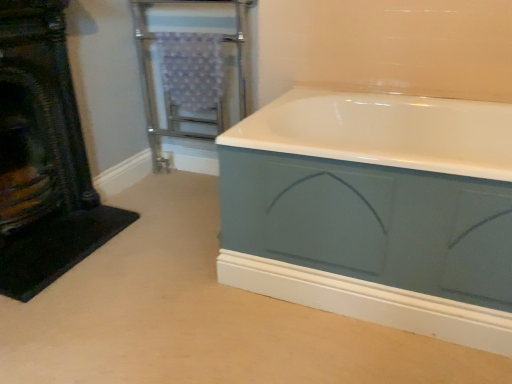
Where is `metallic silver towel rack at upper left`? This screenshot has width=512, height=384. metallic silver towel rack at upper left is located at coordinates (191, 68).

Where is `matte blue bathtub at center`? This screenshot has width=512, height=384. matte blue bathtub at center is located at coordinates (375, 210).

Can you confirm if black textured fireplace at left is thinner than matte blue bathtub at center?

Correct, the width of black textured fireplace at left is less than that of matte blue bathtub at center.

Is black textured fireplace at left not close to matte blue bathtub at center?

They are positioned close to each other.

Can you tell me how much black textured fireplace at left and matte blue bathtub at center differ in facing direction?

The angle between the facing direction of black textured fireplace at left and the facing direction of matte blue bathtub at center is 89.3 degrees.

In the image, is black textured fireplace at left on the left side or the right side of matte blue bathtub at center?

black textured fireplace at left is positioned on matte blue bathtub at center's left side.

From a real-world perspective, is matte blue bathtub at center physically below metallic silver towel rack at upper left?

Indeed, from a real-world perspective, matte blue bathtub at center is positioned beneath metallic silver towel rack at upper left.

Would you say matte blue bathtub at center is outside metallic silver towel rack at upper left?

Yes, matte blue bathtub at center is outside of metallic silver towel rack at upper left.

Which is more distant, [251,243] or [187,87]?

Positioned behind is point [187,87].

Looking at this image, how much distance is there between matte blue bathtub at center and metallic silver towel rack at upper left?

The distance of matte blue bathtub at center from metallic silver towel rack at upper left is 32.79 inches.

Is black textured fireplace at left positioned with its back to metallic silver towel rack at upper left?

No, black textured fireplace at left's orientation is not away from metallic silver towel rack at upper left.

Between black textured fireplace at left and metallic silver towel rack at upper left, which one appears on the right side from the viewer's perspective?

From the viewer's perspective, metallic silver towel rack at upper left appears more on the right side.

From the image's perspective, which one is positioned lower, black textured fireplace at left or metallic silver towel rack at upper left?

black textured fireplace at left is shown below in the image.

Considering the relative sizes of black textured fireplace at left and metallic silver towel rack at upper left in the image provided, is black textured fireplace at left bigger than metallic silver towel rack at upper left?

Incorrect, black textured fireplace at left is not larger than metallic silver towel rack at upper left.

Image resolution: width=512 pixels, height=384 pixels. What are the coordinates of `screen door above the matte blue bathtub at center (from the image's perspective)` in the screenshot? It's located at (191, 68).

Considering the relative positions of metallic silver towel rack at upper left and matte blue bathtub at center in the image provided, is metallic silver towel rack at upper left to the left of matte blue bathtub at center from the viewer's perspective?

Indeed, metallic silver towel rack at upper left is positioned on the left side of matte blue bathtub at center.

Is metallic silver towel rack at upper left behind matte blue bathtub at center?

Yes, it is.

Looking at this image, what's the angular difference between metallic silver towel rack at upper left and matte blue bathtub at center's facing directions?

0.0788 degrees.

Image resolution: width=512 pixels, height=384 pixels. I want to click on fireplace in front of the metallic silver towel rack at upper left, so click(42, 156).

From the image's perspective, which is below, metallic silver towel rack at upper left or black textured fireplace at left?

black textured fireplace at left is shown below in the image.

Is metallic silver towel rack at upper left facing away from black textured fireplace at left?

No, metallic silver towel rack at upper left is not facing the opposite direction of black textured fireplace at left.

Is metallic silver towel rack at upper left in front of or behind black textured fireplace at left in the image?

Visually, metallic silver towel rack at upper left is located behind black textured fireplace at left.

Measure the distance between matte blue bathtub at center and black textured fireplace at left.

matte blue bathtub at center and black textured fireplace at left are 36.14 inches apart from each other.

Considering the sizes of matte blue bathtub at center and black textured fireplace at left in the image, is matte blue bathtub at center bigger or smaller than black textured fireplace at left?

In the image, matte blue bathtub at center appears to be larger than black textured fireplace at left.

Is matte blue bathtub at center looking in the opposite direction of black textured fireplace at left?

No, matte blue bathtub at center is not facing away from black textured fireplace at left.

Is matte blue bathtub at center placed right next to black textured fireplace at left?

No, matte blue bathtub at center is not making contact with black textured fireplace at left.

Find the location of `bathtub beneath the black textured fireplace at left (from a real-world perspective)`. bathtub beneath the black textured fireplace at left (from a real-world perspective) is located at coordinates (375, 210).

Find the location of a particular element. This screenshot has height=384, width=512. screen door lying on the left of matte blue bathtub at center is located at coordinates (191, 68).

Looking at this image, considering their positions, is matte blue bathtub at center positioned closer to metallic silver towel rack at upper left than black textured fireplace at left?

black textured fireplace at left is closer to metallic silver towel rack at upper left.

When comparing their distances from black textured fireplace at left, does matte blue bathtub at center or metallic silver towel rack at upper left seem further?

matte blue bathtub at center is further to black textured fireplace at left.

Considering their positions, is metallic silver towel rack at upper left positioned further to black textured fireplace at left than matte blue bathtub at center?

Based on the image, matte blue bathtub at center appears to be further to black textured fireplace at left.

When comparing their distances from matte blue bathtub at center, does black textured fireplace at left or metallic silver towel rack at upper left seem further?

Based on the image, black textured fireplace at left appears to be further to matte blue bathtub at center.

Based on their spatial positions, is metallic silver towel rack at upper left or black textured fireplace at left closer to matte blue bathtub at center?

Among the two, metallic silver towel rack at upper left is located nearer to matte blue bathtub at center.

From the image, which object appears to be nearer to metallic silver towel rack at upper left, black textured fireplace at left or matte blue bathtub at center?

black textured fireplace at left lies closer to metallic silver towel rack at upper left than the other object.

This screenshot has height=384, width=512. I want to click on screen door between black textured fireplace at left and matte blue bathtub at center from left to right, so click(x=191, y=68).